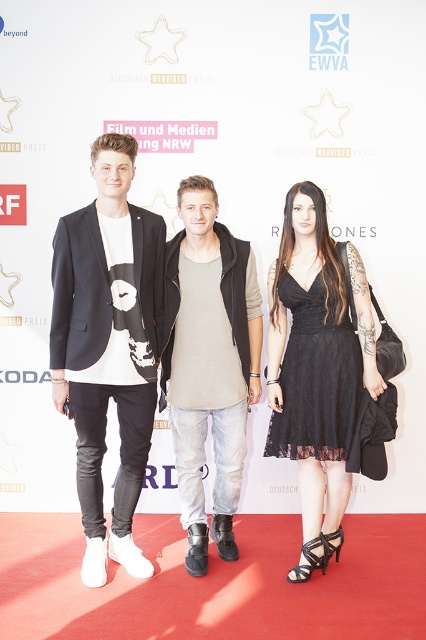
Question: Which point is closer to the camera taking this photo?

Choices:
 (A) (238, 472)
 (B) (305, 198)
 (C) (131, 301)

Answer: (C)

Question: Can you confirm if matte black blazer at center is positioned above black lace dress at center?

Choices:
 (A) no
 (B) yes

Answer: (B)

Question: Does matte black blazer at center come behind denim jeans at center?

Choices:
 (A) yes
 (B) no

Answer: (B)

Question: Which point is closer to the camera?

Choices:
 (A) denim jeans at center
 (B) matte black blazer at center

Answer: (B)

Question: Can you confirm if black lace dress at center is positioned to the right of denim jeans at center?

Choices:
 (A) yes
 (B) no

Answer: (A)

Question: Which is farther from the denim jeans at center?

Choices:
 (A) matte black blazer at center
 (B) black lace dress at center

Answer: (B)